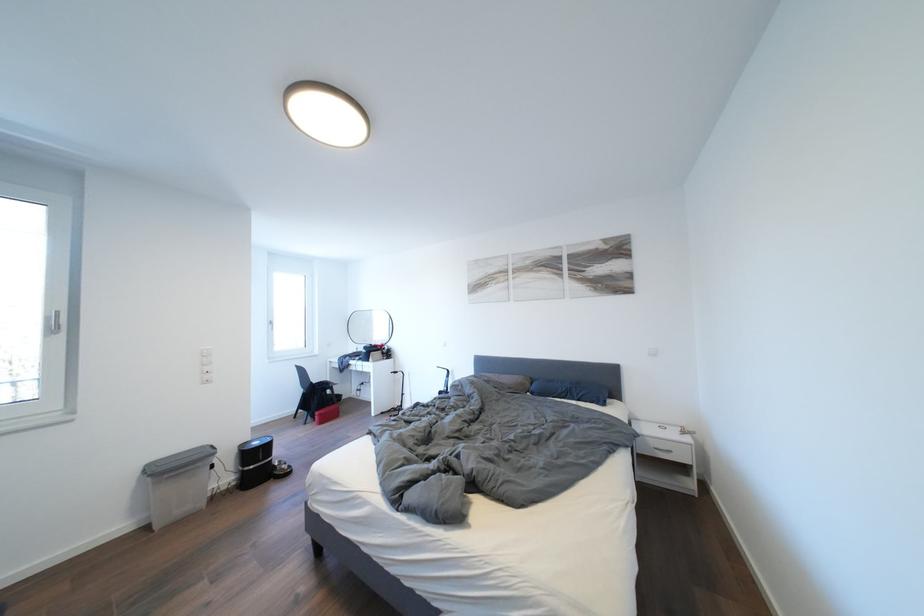
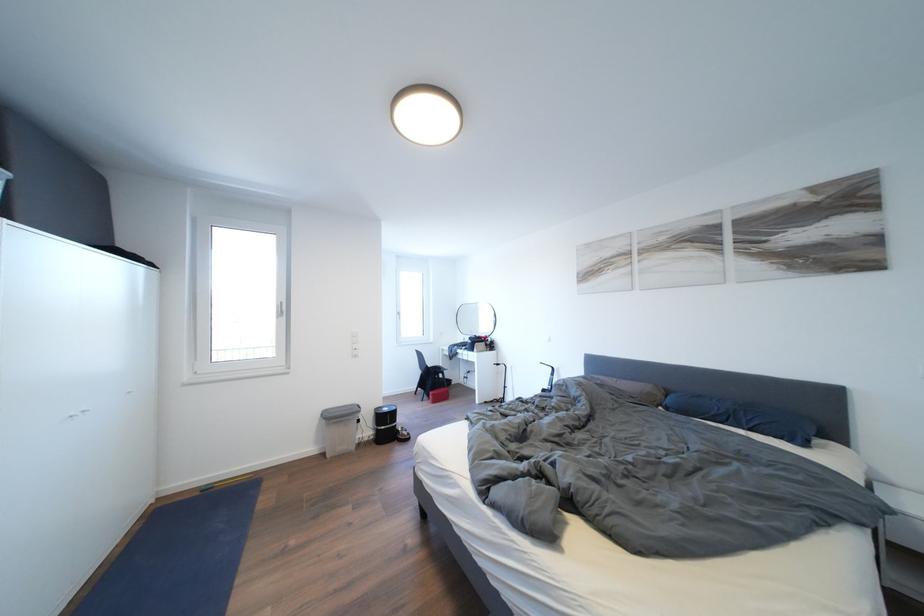
Question: The camera is either moving clockwise (left) or counter-clockwise (right) around the object. The first image is from the beginning of the video and the second image is from the end. Is the camera moving left or right when shooting the video?

Choices:
 (A) Left
 (B) Right

Answer: (B)